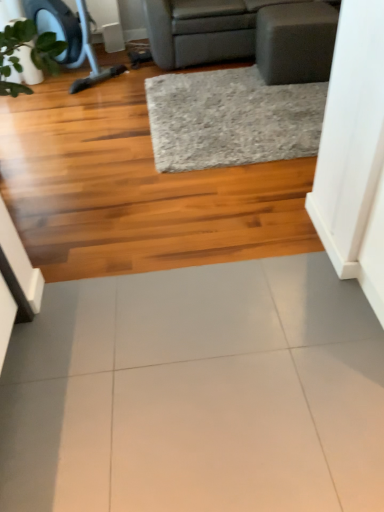
Question: Does gray fabric studio couch at upper center have a greater width compared to gray textured rug at center?

Choices:
 (A) no
 (B) yes

Answer: (B)

Question: Considering the relative positions of gray fabric studio couch at upper center and gray textured rug at center in the image provided, is gray fabric studio couch at upper center to the left of gray textured rug at center from the viewer's perspective?

Choices:
 (A) yes
 (B) no

Answer: (B)

Question: Is gray fabric studio couch at upper center further to the viewer compared to gray textured rug at center?

Choices:
 (A) yes
 (B) no

Answer: (A)

Question: Is the depth of gray fabric studio couch at upper center less than that of gray textured rug at center?

Choices:
 (A) yes
 (B) no

Answer: (B)

Question: Can gray textured rug at center be found inside gray fabric studio couch at upper center?

Choices:
 (A) yes
 (B) no

Answer: (B)

Question: Looking at their shapes, would you say white glossy tile at center is wider or thinner than gray textured rug at center?

Choices:
 (A) thin
 (B) wide

Answer: (A)

Question: From the image's perspective, is white glossy tile at center positioned above or below gray textured rug at center?

Choices:
 (A) above
 (B) below

Answer: (B)

Question: Considering the positions of white glossy tile at center and gray textured rug at center in the image, is white glossy tile at center bigger or smaller than gray textured rug at center?

Choices:
 (A) small
 (B) big

Answer: (A)

Question: Considering their positions, is white glossy tile at center located in front of or behind gray textured rug at center?

Choices:
 (A) behind
 (B) front

Answer: (B)

Question: From a real-world perspective, is gray textured rug at center above or below white glossy tile at center?

Choices:
 (A) below
 (B) above

Answer: (B)

Question: Is point (173, 104) closer or farther from the camera than point (193, 480)?

Choices:
 (A) farther
 (B) closer

Answer: (A)

Question: Is gray textured rug at center to the left or to the right of white glossy tile at center in the image?

Choices:
 (A) left
 (B) right

Answer: (B)

Question: Considering the positions of gray textured rug at center and white glossy tile at center in the image, is gray textured rug at center taller or shorter than white glossy tile at center?

Choices:
 (A) tall
 (B) short

Answer: (A)

Question: From the image's perspective, is gray fabric studio couch at upper center positioned above or below white glossy tile at center?

Choices:
 (A) below
 (B) above

Answer: (B)

Question: Considering their positions, is gray fabric studio couch at upper center located in front of or behind white glossy tile at center?

Choices:
 (A) behind
 (B) front

Answer: (A)